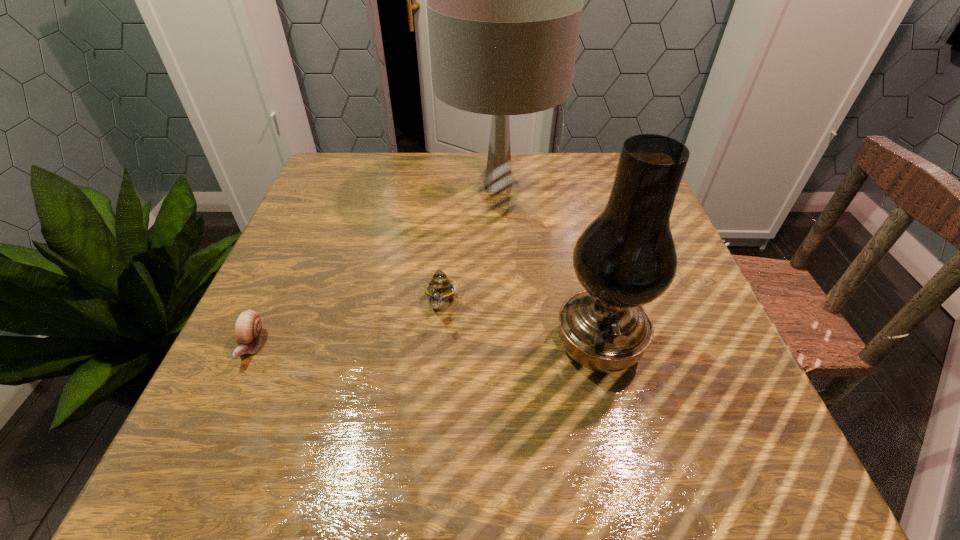
Where is `empty space between the lampshade and the shorter escargot`? The image size is (960, 540). empty space between the lampshade and the shorter escargot is located at coordinates (374, 266).

Point out which object is positioned as the third nearest to the third tallest object. Please provide its 2D coordinates. Your answer should be formatted as a tuple, i.e. [(x, y)], where the tuple contains the x and y coordinates of a point satisfying the conditions above.

[(248, 328)]

I want to click on object that can be found as the closest to the oil lamp, so click(440, 289).

I want to click on free spot that satisfies the following two spatial constraints: 1. on the front-facing side of the lampshade; 2. on the left side of the oil lamp, so click(x=507, y=346).

The image size is (960, 540). In order to click on free space that satisfies the following two spatial constraints: 1. on the front-facing side of the lampshade; 2. on the face of the right escargot in this screenshot , I will do coord(505,307).

You are a GUI agent. You are given a task and a screenshot of the screen. Output one action in this format:
    pyautogui.click(x=<x>, y=<y>)
    Task: Click on the vacant position in the image that satisfies the following two spatial constraints: 1. on the face of the oil lamp; 2. on the left side of the right escargot
    The height and width of the screenshot is (540, 960).
    Given the screenshot: What is the action you would take?
    pyautogui.click(x=439, y=346)

This screenshot has height=540, width=960. I want to click on vacant point that satisfies the following two spatial constraints: 1. on the front-facing side of the farthest object; 2. on the front-facing side of the shorter escargot, so click(x=507, y=345).

This screenshot has height=540, width=960. I want to click on free space that satisfies the following two spatial constraints: 1. on the front-facing side of the shortest object; 2. on the right side of the oil lamp, so pyautogui.click(x=252, y=346).